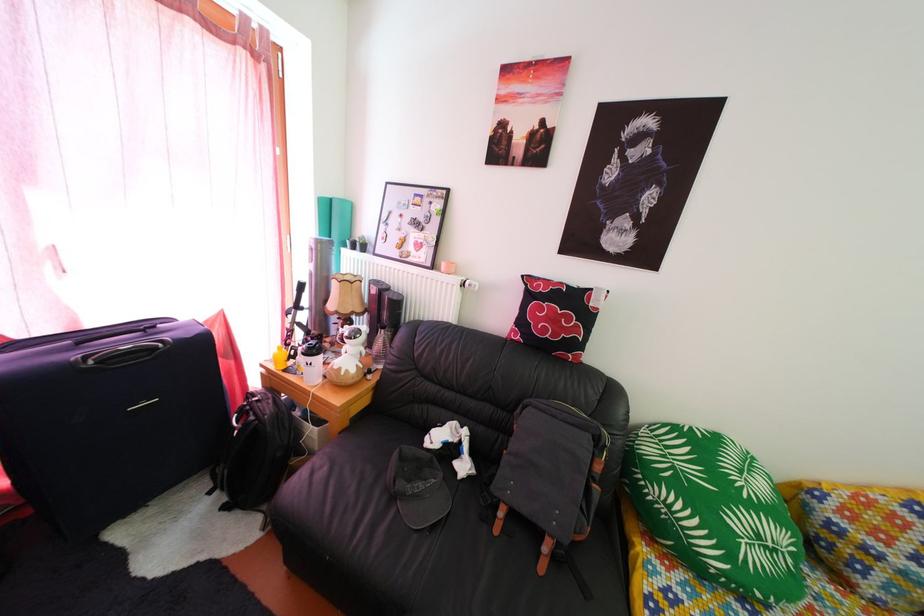
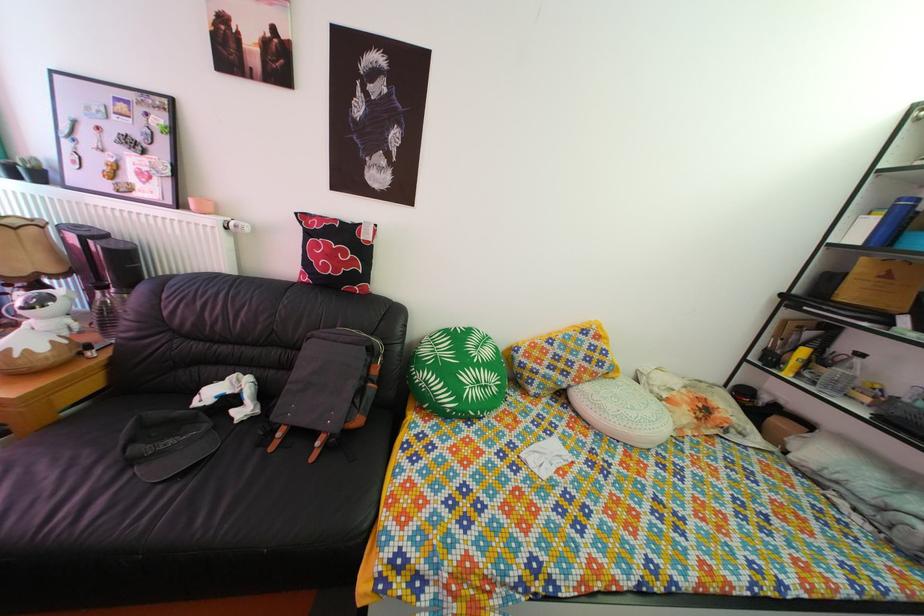
Locate, in the second image, the point that corresponds to point (784, 560) in the first image.

(494, 395)